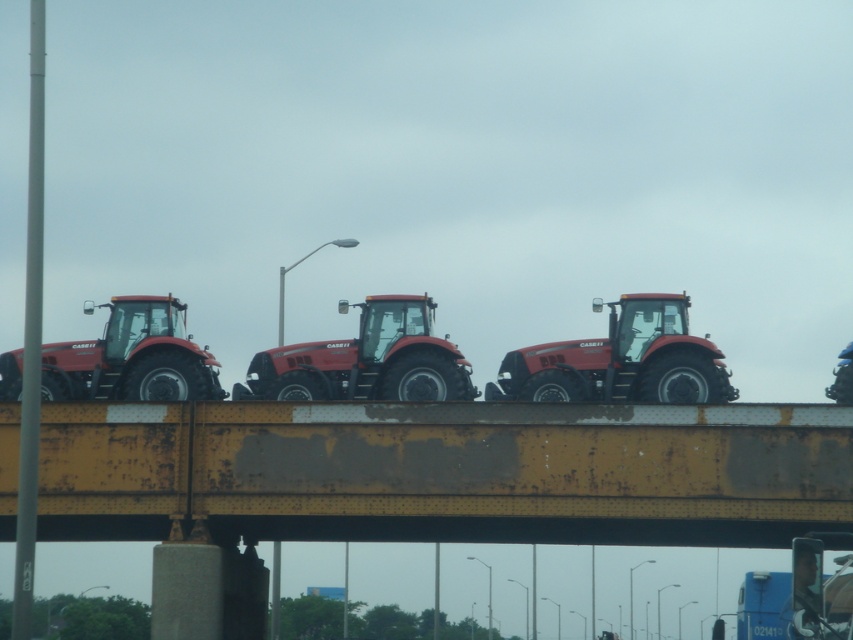
Question: Does yellow rusted steel bridge at center appear over matte black tractor at left?

Choices:
 (A) yes
 (B) no

Answer: (B)

Question: Which point is closer to the camera?

Choices:
 (A) (701, 534)
 (B) (265, 358)
 (C) (132, 349)

Answer: (C)

Question: Where is yellow rusted steel bridge at center located in relation to matte black tractor at left in the image?

Choices:
 (A) above
 (B) below

Answer: (B)

Question: Among these objects, which one is nearest to the camera?

Choices:
 (A) matte black tractor at center
 (B) yellow rusted steel bridge at center
 (C) matte black tractor at left
 (D) matte red tractor at center

Answer: (B)

Question: Considering the relative positions of yellow rusted steel bridge at center and matte red tractor at center in the image provided, where is yellow rusted steel bridge at center located with respect to matte red tractor at center?

Choices:
 (A) above
 (B) below

Answer: (B)

Question: Which point appears farthest from the camera in this image?

Choices:
 (A) (809, 454)
 (B) (289, 349)
 (C) (635, 346)

Answer: (C)